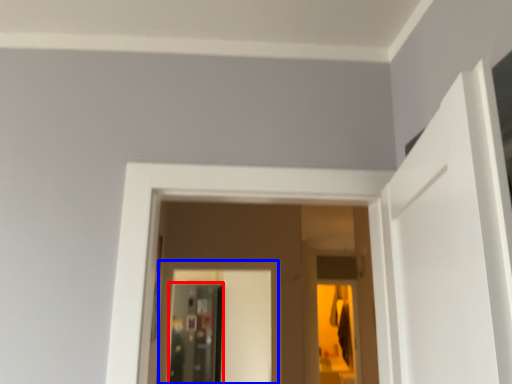
Question: Among these objects, which one is nearest to the camera, screen door (highlighted by a red box) or screen door (highlighted by a blue box)?

Choices:
 (A) screen door
 (B) screen door

Answer: (B)